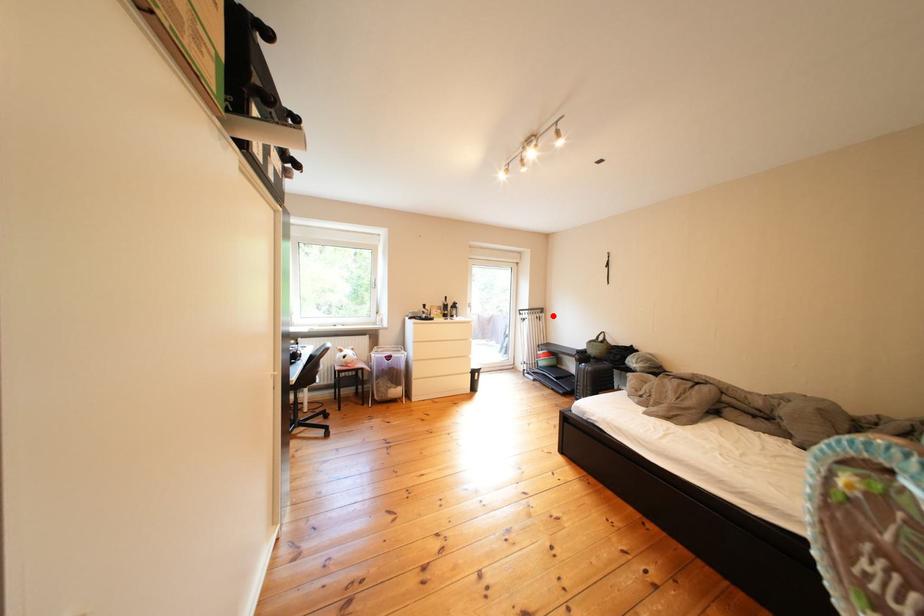
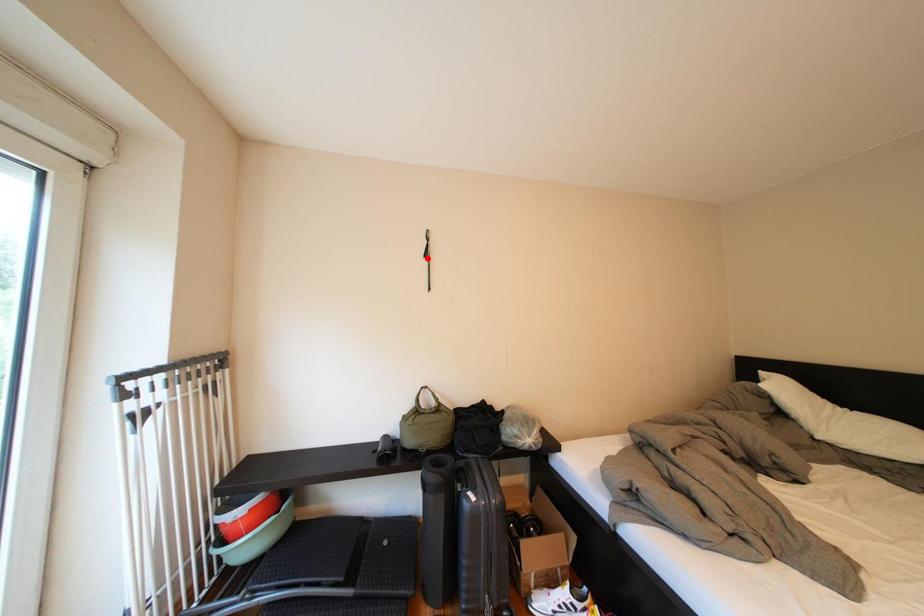
I am providing you with two images of the same scene from different viewpoints. A red point is marked on the first image and another point is marked on the second image. Do the highlighted points in image1 and image2 indicate the same real-world spot?

No